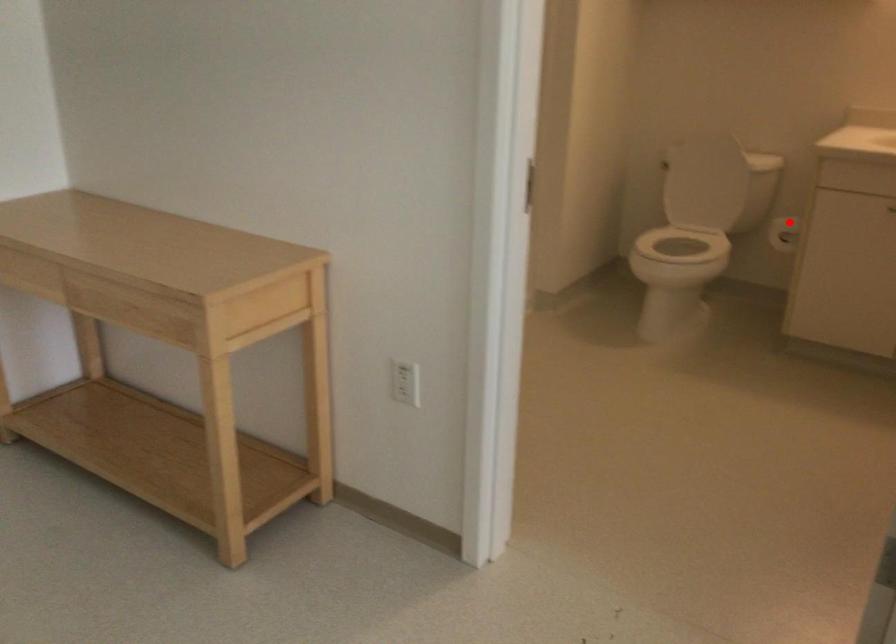
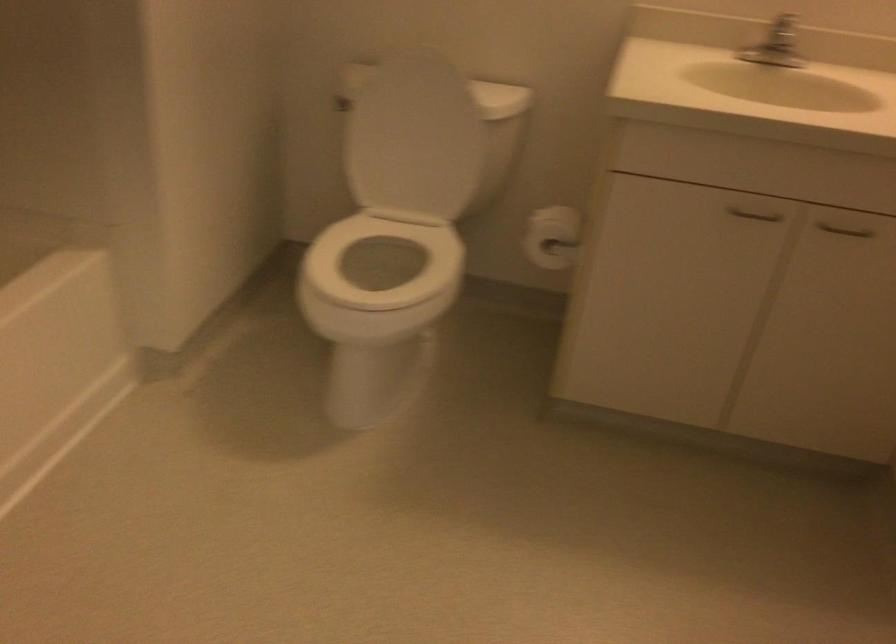
In the second image, find the point that corresponds to the highlighted location in the first image.

(552, 237)